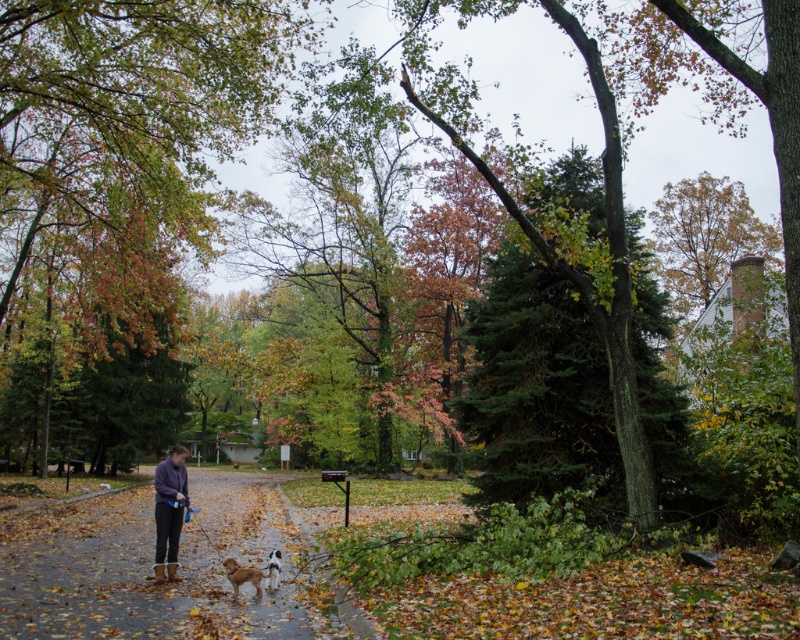
You are a landscape architect designing a garden path. The garden path must pass through the point indicated by point [537,385]. What is the nearest object to this point that you should consider when planning the path?

The nearest object to point [537,385] is the green textured evergreen tree at center, so you should consider its location when planning the path.

You are a delivery person needing to deliver a package to the house located at the end of the dark gray asphalt path at lower left. The golden fur dog at center is blocking your path. Can you walk around the dog to reach the path?

The distance between the dark gray asphalt path at lower left and the golden fur dog at center is 18.01 feet, so yes, you can walk around the dog to reach the path since there is enough space between them.